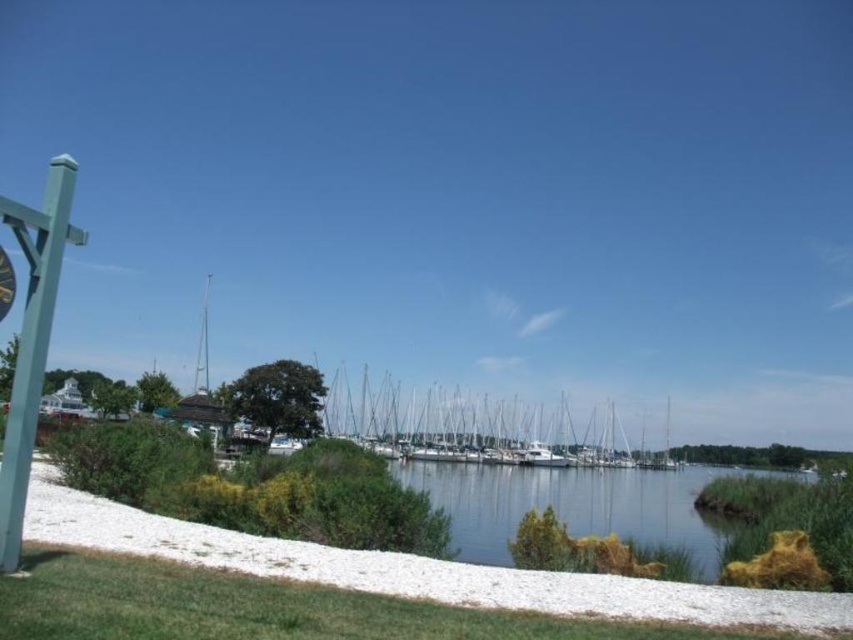
You are standing at the point closer to the viewer between point (590, 426) and point (1, 250). Which point are you standing at?

You are standing at point (590, 426) because it is further to the viewer than point (1, 250).

You are standing at the point closer to the viewer between point (x=611, y=449) and point (x=10, y=204). Which point are you at?

You are at point (x=611, y=449) because it is further to the viewer than point (x=10, y=204).

Looking at this image, you are a maintenance worker needing to replace a part that requires reaching both the green painted wood post at left and the metallic gold clock at left. If your ladder is 18 inches long, will it be sufficient to bridge the gap between them?

The green painted wood post at left and metallic gold clock at left are 18.39 inches apart from each other. Since the ladder is only 18 inches long, it would be 0.39 inches too short to bridge the gap between them.